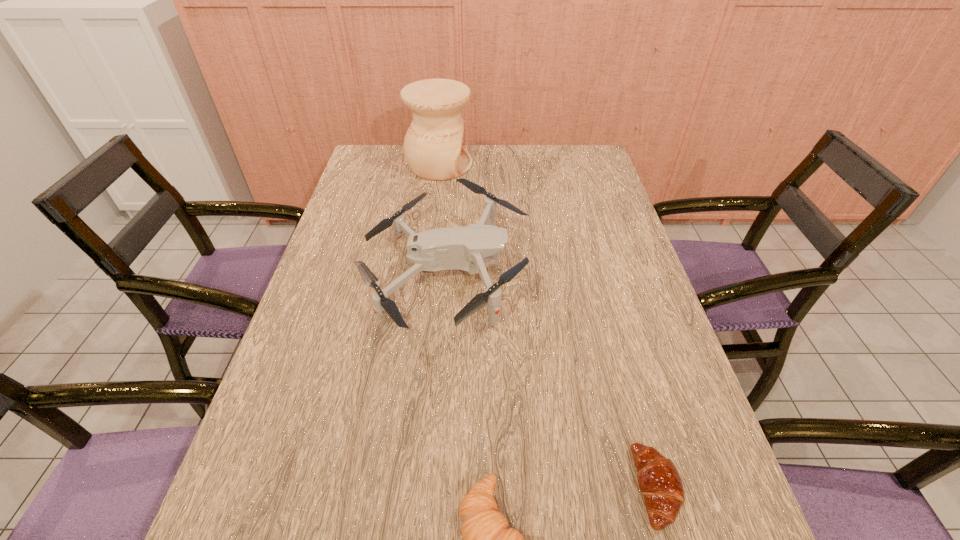
You are a GUI agent. You are given a task and a screenshot of the screen. Output one action in this format:
    pyautogui.click(x=<x>, y=<y>)
    Task: Click on the tallest object
    
    Given the screenshot: What is the action you would take?
    pyautogui.click(x=434, y=149)

Find the location of a particular element. Image resolution: width=960 pixels, height=540 pixels. pottery is located at coordinates (434, 149).

Locate an element on the screen. This screenshot has height=540, width=960. drone is located at coordinates (467, 248).

Identify the location of the third shortest object. The image size is (960, 540). (467, 248).

The height and width of the screenshot is (540, 960). What are the coordinates of `the right crescent roll` in the screenshot? It's located at (x=660, y=484).

The image size is (960, 540). I want to click on the rightmost object, so click(x=660, y=484).

Find the location of a particular element. This screenshot has height=540, width=960. free space located at the open side of the farthest object is located at coordinates (556, 165).

In order to click on vacant region located with a camera at the front of the drone in this screenshot , I will do [x=566, y=275].

What are the coordinates of `free space located on the back of the shorter crescent roll` in the screenshot? It's located at (606, 303).

In order to click on object located in the far edge section of the desktop in this screenshot , I will do `click(434, 149)`.